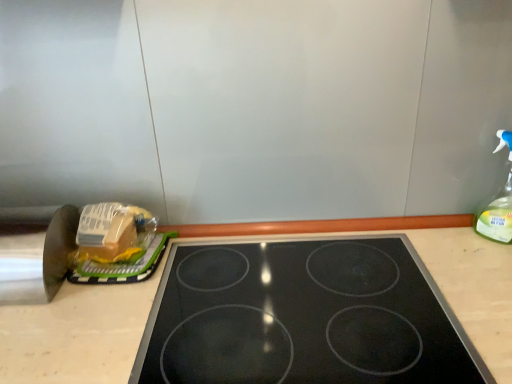
I want to click on free spot above black glass gas stove at center (from a real-world perspective), so click(x=315, y=285).